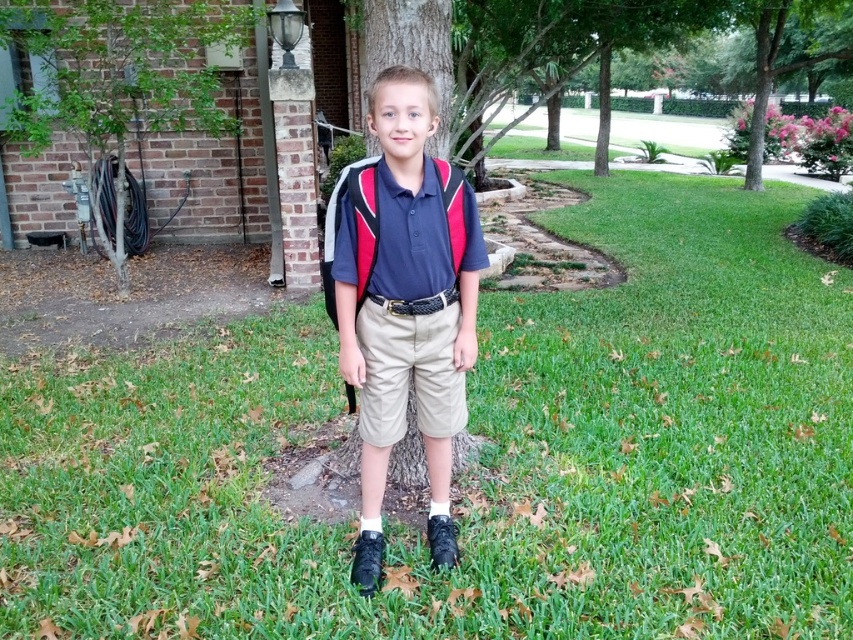
Is green grass at center below matte blue shirt at center?

Indeed, green grass at center is positioned under matte blue shirt at center.

Which is more to the left, green grass at center or matte blue shirt at center?

From the viewer's perspective, green grass at center appears more on the left side.

Which is behind, point (498, 547) or point (360, 380)?

The point (498, 547) is behind.

Locate an element on the screen. The width and height of the screenshot is (853, 640). green grass at center is located at coordinates (482, 456).

Is point (170, 45) positioned after point (462, 401)?

Yes, it is behind point (462, 401).

Does green leafy tree at left have a greater height compared to khaki cotton shorts at center?

Indeed, green leafy tree at left has a greater height compared to khaki cotton shorts at center.

Does point (125, 168) lie behind point (418, 365)?

Yes, point (125, 168) is behind point (418, 365).

I want to click on green leafy tree at left, so click(119, 81).

Is green grass at center to the right of green leafy tree at left from the viewer's perspective?

Correct, you'll find green grass at center to the right of green leafy tree at left.

Is point (850, 618) farther from camera compared to point (123, 26)?

That is False.

Where is `green grass at center`? green grass at center is located at coordinates pos(482,456).